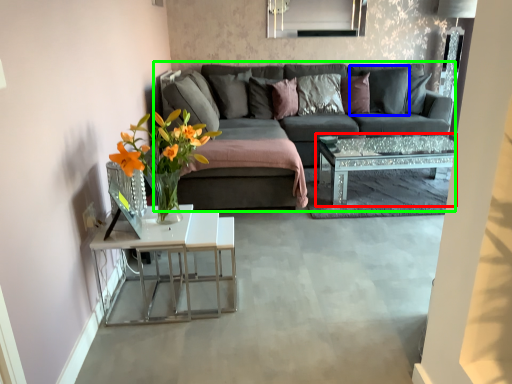
Question: Which object is positioned farthest from coffee table (highlighted by a red box)? Select from pillow (highlighted by a blue box) and studio couch (highlighted by a green box).

Choices:
 (A) pillow
 (B) studio couch

Answer: (A)